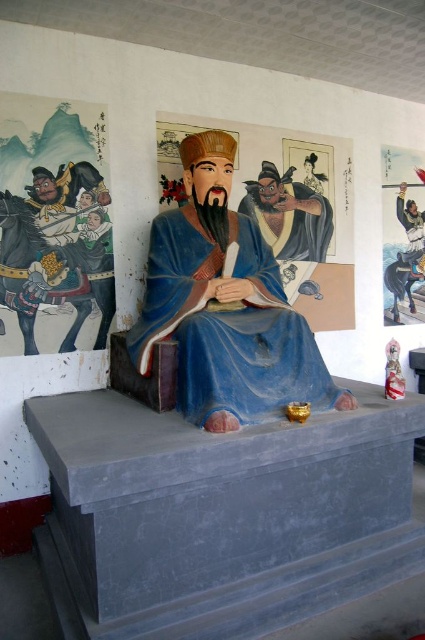
Question: Can you confirm if blue matte robe at center is positioned to the right of matte blue statue at center?

Choices:
 (A) no
 (B) yes

Answer: (A)

Question: Which of the following is the closest to the observer?

Choices:
 (A) matte blue statue at center
 (B) blue matte robe at center

Answer: (B)

Question: Does blue matte robe at center appear over matte blue statue at center?

Choices:
 (A) no
 (B) yes

Answer: (A)

Question: Which point appears farthest from the camera in this image?

Choices:
 (A) (300, 195)
 (B) (207, 385)

Answer: (A)

Question: Is blue matte robe at center smaller than matte blue statue at center?

Choices:
 (A) no
 (B) yes

Answer: (A)